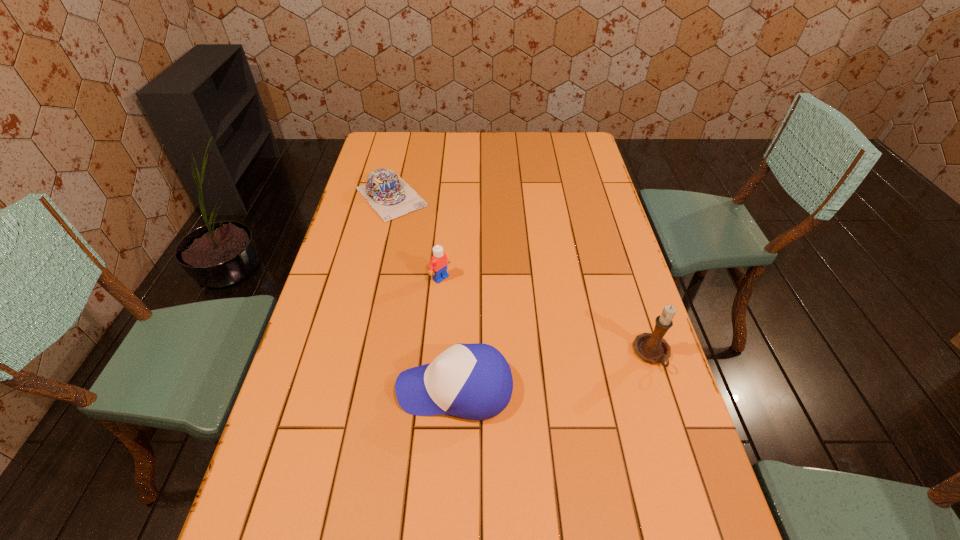
Find the location of a particular element. vacant point located on the face of the second farthest object is located at coordinates (536, 350).

Where is `free region located on the face of the second farthest object`? The image size is (960, 540). free region located on the face of the second farthest object is located at coordinates (471, 301).

Where is `free location located 0.270m on the face of the second farthest object`? free location located 0.270m on the face of the second farthest object is located at coordinates (516, 335).

Find the location of a particular element. vacant space situated on the front, side, and top of the shortest object is located at coordinates (430, 240).

Where is `free point located on the front, side, and top of the shortest object`? Image resolution: width=960 pixels, height=540 pixels. free point located on the front, side, and top of the shortest object is located at coordinates (420, 231).

This screenshot has width=960, height=540. I want to click on free space located 0.300m on the front, side, and top of the shortest object, so click(x=456, y=269).

Locate an element on the screen. This screenshot has height=540, width=960. object positioned at the left edge is located at coordinates (389, 195).

Find the location of a particular element. This screenshot has width=960, height=540. object positioned at the right edge is located at coordinates (652, 347).

In the image, there is a desktop. Identify the location of vacant space at the far edge. Image resolution: width=960 pixels, height=540 pixels. (502, 144).

This screenshot has width=960, height=540. I want to click on free point at the left edge, so click(334, 346).